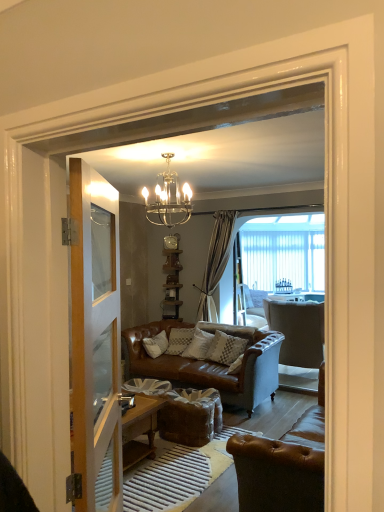
Question: From their relative heights in the image, would you say clear glass chandelier at upper center is taller or shorter than light gray fabric armchair at center, which appears as the second chair when viewed from the front?

Choices:
 (A) tall
 (B) short

Answer: (B)

Question: Is clear glass chandelier at upper center inside the boundaries of light gray fabric armchair at center, which appears as the second chair when viewed from the front, or outside?

Choices:
 (A) outside
 (B) inside

Answer: (A)

Question: Which object is the closest to the clear glass chandelier at upper center?

Choices:
 (A) light gray fabric armchair at center, which appears as the second chair when viewed from the front
 (B) brown leather chair at lower right, which appears as the 2th chair when viewed from the back
 (C) metallic silver clock at upper center
 (D) clear glass door at left
 (E) textured beige pillow at center

Answer: (D)

Question: Estimate the real-world distances between objects in this image. Which object is closer to the clear glass door at left?

Choices:
 (A) metallic silver clock at upper center
 (B) brown leather chair at lower right, which appears as the 2th chair when viewed from the back
 (C) light gray fabric armchair at center, the 1th chair positioned from the back
 (D) textured beige pillow at center
 (E) clear glass chandelier at upper center

Answer: (B)